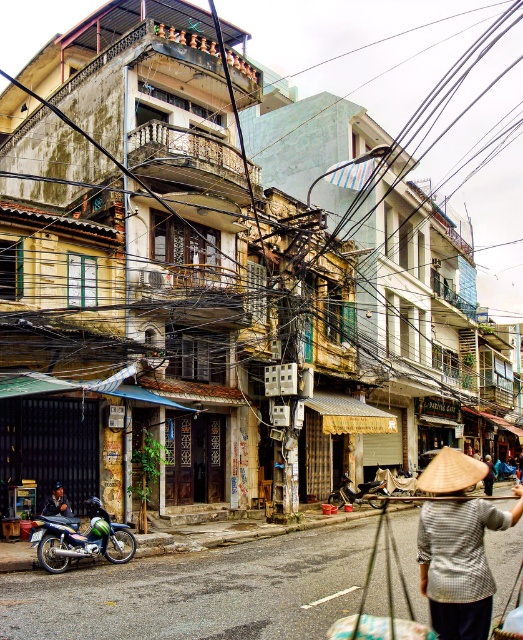
Which is more to the left, blue metallic motorcycle at center-left or natural straw hat at center?

From the viewer's perspective, blue metallic motorcycle at center-left appears more on the left side.

Which is below, blue metallic motorcycle at center-left or natural straw hat at center?

blue metallic motorcycle at center-left is below.

Between point (31, 538) and point (458, 481), which one is positioned in front?

Positioned in front is point (458, 481).

The height and width of the screenshot is (640, 523). I want to click on blue metallic motorcycle at center-left, so (81, 538).

Who is positioned more to the right, green matte motorcycle at center or dark blue shirt at center?

From the viewer's perspective, green matte motorcycle at center appears more on the right side.

This screenshot has width=523, height=640. I want to click on green matte motorcycle at center, so click(x=358, y=492).

Is blue metallic motorcycle at center-left thinner than dark blue shirt at center?

No, blue metallic motorcycle at center-left is not thinner than dark blue shirt at center.

Can you confirm if blue metallic motorcycle at center-left is positioned to the left of dark blue shirt at center?

Incorrect, blue metallic motorcycle at center-left is not on the left side of dark blue shirt at center.

Does point (52, 568) come closer to viewer compared to point (70, 513)?

Yes, it is in front of point (70, 513).

You are a GUI agent. You are given a task and a screenshot of the screen. Output one action in this format:
    pyautogui.click(x=<x>, y=<y>)
    Task: Click on the blue metallic motorcycle at center-left
    Image resolution: width=523 pixels, height=640 pixels.
    Given the screenshot: What is the action you would take?
    pyautogui.click(x=81, y=538)